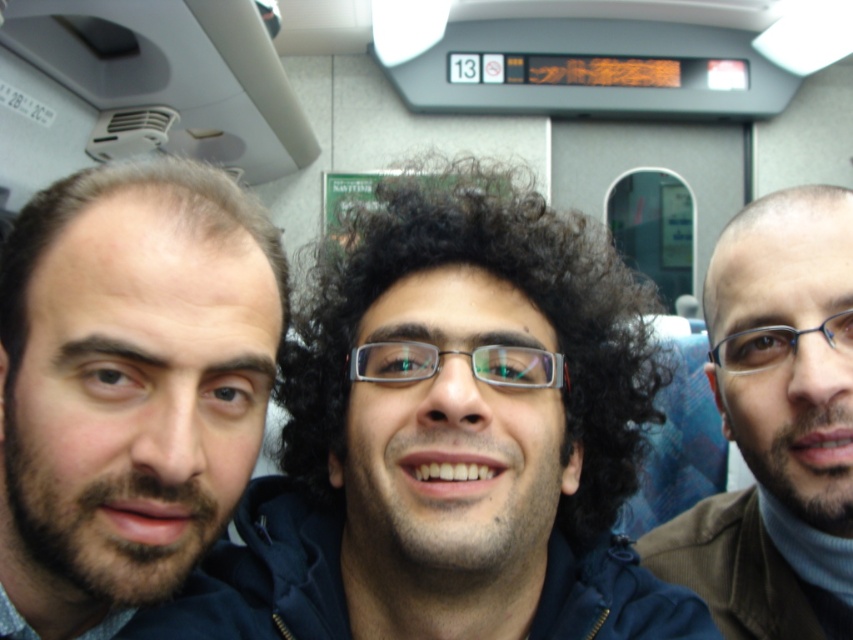
Is dark blue jacket at center thinner than bearded man at left?

No.

Between dark blue jacket at center and bearded man at left, which one is positioned higher?

dark blue jacket at center is higher up.

Which is behind, point (396, 189) or point (143, 266)?

The point (396, 189) is more distant.

Where is `dark blue jacket at center`? This screenshot has height=640, width=853. dark blue jacket at center is located at coordinates pos(450,440).

This screenshot has width=853, height=640. What do you see at coordinates (450, 440) in the screenshot?
I see `dark blue jacket at center` at bounding box center [450, 440].

Does dark blue jacket at center appear over brown woolen sweater at right?

Correct, dark blue jacket at center is located above brown woolen sweater at right.

This screenshot has height=640, width=853. What are the coordinates of `dark blue jacket at center` in the screenshot? It's located at (450, 440).

Where is `dark blue jacket at center`? This screenshot has height=640, width=853. dark blue jacket at center is located at coordinates (450, 440).

Can you confirm if bearded man at left is positioned to the right of brown woolen sweater at right?

No, bearded man at left is not to the right of brown woolen sweater at right.

Does bearded man at left lie in front of brown woolen sweater at right?

Yes, it is.

Describe the element at coordinates (129, 381) in the screenshot. The height and width of the screenshot is (640, 853). I see `bearded man at left` at that location.

Where is `bearded man at left`? This screenshot has width=853, height=640. bearded man at left is located at coordinates (129, 381).